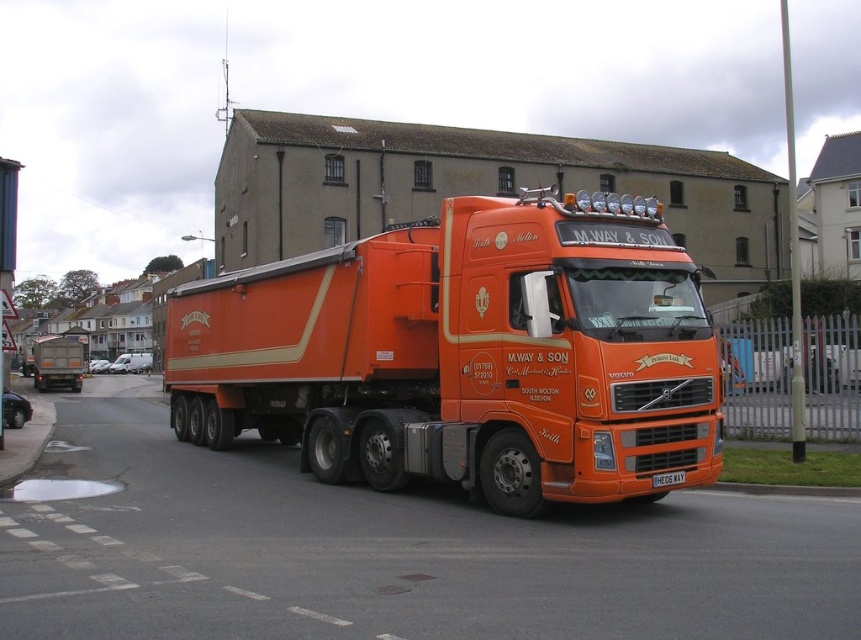
Question: Which point appears farthest from the camera in this image?

Choices:
 (A) (480, 445)
 (B) (73, 356)

Answer: (B)

Question: Which object is closer to the camera taking this photo?

Choices:
 (A) orange matte truck at center
 (B) white plastic license plate at center
 (C) orange matte trailer truck at center

Answer: (C)

Question: Does orange matte trailer truck at center have a larger size compared to white plastic license plate at center?

Choices:
 (A) yes
 (B) no

Answer: (A)

Question: Is the position of orange matte trailer truck at center less distant than that of white plastic license plate at center?

Choices:
 (A) no
 (B) yes

Answer: (B)

Question: Which is farther from the orange matte trailer truck at center?

Choices:
 (A) white plastic license plate at center
 (B) orange matte truck at center

Answer: (B)

Question: Does orange matte trailer truck at center appear on the right side of orange matte truck at center?

Choices:
 (A) yes
 (B) no

Answer: (A)